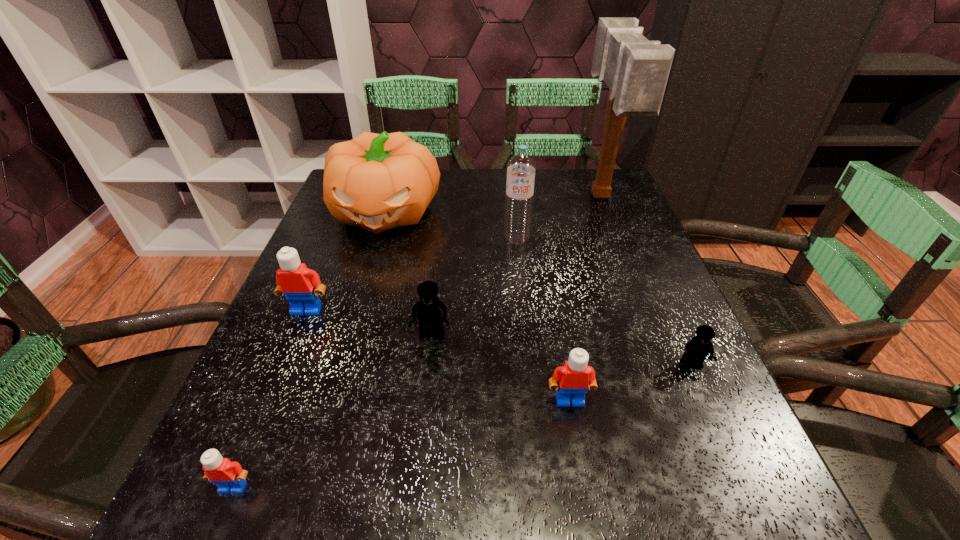
You are a GUI agent. You are given a task and a screenshot of the screen. Output one action in this format:
    pyautogui.click(x=<x>, y=<y>)
    Task: Click on the tallest object
    This screenshot has width=960, height=540.
    Given the screenshot: What is the action you would take?
    pyautogui.click(x=636, y=70)

Locate an element on the screen. Image resolution: width=960 pixels, height=540 pixels. wood mallet is located at coordinates (636, 70).

In order to click on water bottle in this screenshot , I will do `click(521, 167)`.

What are the coordinates of `pumpkin` in the screenshot? It's located at (375, 181).

This screenshot has height=540, width=960. What are the coordinates of `the fourth farthest object` in the screenshot? It's located at (296, 282).

Identify the location of the farthest Lego. The image size is (960, 540). (296, 282).

Where is `the second nearest object`? Image resolution: width=960 pixels, height=540 pixels. the second nearest object is located at coordinates (575, 377).

Locate an element on the screen. This screenshot has height=540, width=960. the fourth Lego from left to right is located at coordinates (575, 377).

Where is `the second farthest Lego`? The height and width of the screenshot is (540, 960). the second farthest Lego is located at coordinates (430, 311).

The image size is (960, 540). Identify the location of the fifth farthest object. (430, 311).